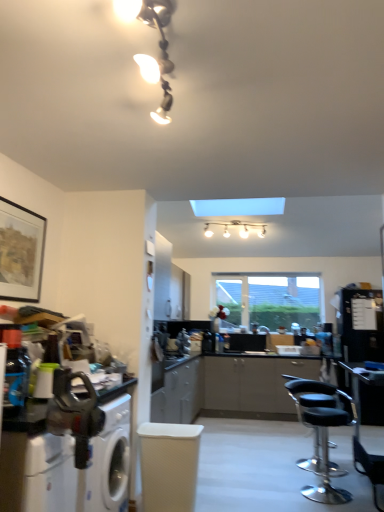
Question: In terms of size, does white glossy light fixture at upper center appear bigger or smaller than transparent glass window at center?

Choices:
 (A) big
 (B) small

Answer: (B)

Question: Is white glossy light fixture at upper center in front of or behind transparent glass window at center in the image?

Choices:
 (A) behind
 (B) front

Answer: (B)

Question: Based on their relative distances, which object is nearer to the black leather chair at lower right, which ranks as the second chair in left-to-right order?

Choices:
 (A) metallic glass light fixture at upper center
 (B) white glossy light fixture at upper center
 (C) metallic silver countertop at lower left
 (D) black leather stool at lower right, arranged as the first chair when viewed from the left
 (E) transparent glass window at center

Answer: (D)

Question: Which object is the closest to the white glossy light fixture at upper center?

Choices:
 (A) metallic glass light fixture at upper center
 (B) transparent glass window at center
 (C) black leather stool at lower right, placed as the second chair when sorted from right to left
 (D) white textured swivel chair at center
 (E) metallic silver countertop at lower left

Answer: (B)